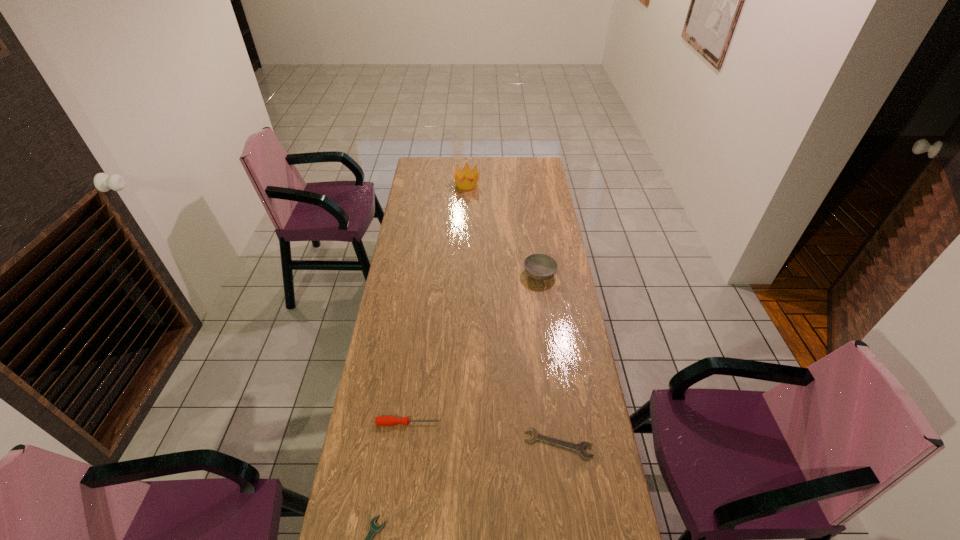
At what (x,y) coordinates should I click in order to perform the action: click on crown. Please return your answer as a coordinate pair (x, y). Looking at the image, I should click on (466, 173).

At what (x,y) coordinates should I click in order to perform the action: click on the tallest object. Please return your answer as a coordinate pair (x, y). The height and width of the screenshot is (540, 960). Looking at the image, I should click on (466, 173).

At what (x,y) coordinates should I click in order to perform the action: click on the fourth shortest object. Please return your answer as a coordinate pair (x, y). The height and width of the screenshot is (540, 960). Looking at the image, I should click on (539, 266).

Where is `the second farthest object`? The image size is (960, 540). the second farthest object is located at coordinates (539, 266).

Locate an element on the screen. This screenshot has width=960, height=540. the third shortest object is located at coordinates (380, 420).

This screenshot has width=960, height=540. What are the coordinates of `screwdriver` in the screenshot? It's located at (380, 420).

This screenshot has width=960, height=540. Find the location of `the farther wrench`. the farther wrench is located at coordinates (580, 447).

Where is `the right wrench`? the right wrench is located at coordinates (580, 447).

Identify the location of free space located 0.350m on the right of the tallest object. The height and width of the screenshot is (540, 960). (543, 184).

Where is `vacant region located 0.260m on the front of the second tallest object`? The height and width of the screenshot is (540, 960). vacant region located 0.260m on the front of the second tallest object is located at coordinates (548, 334).